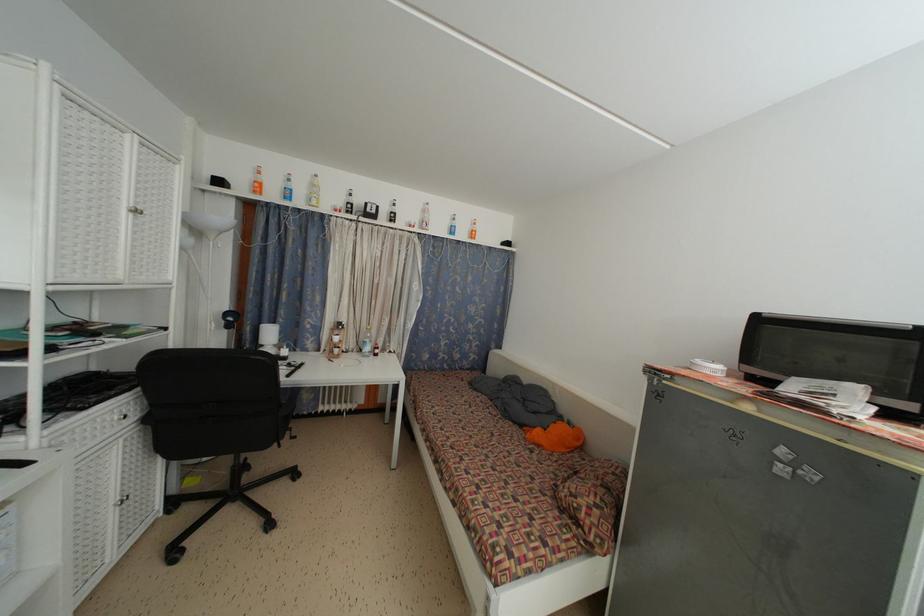
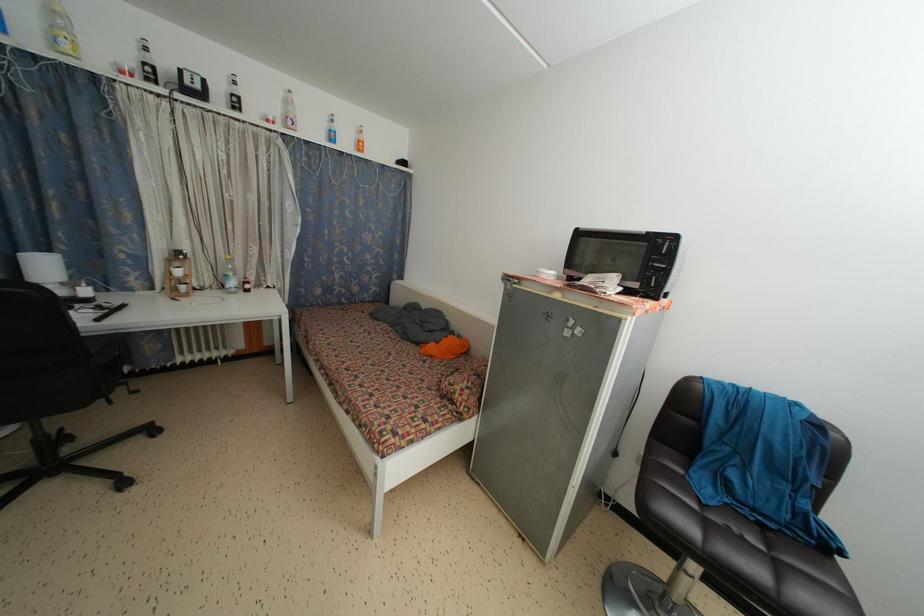
In the second image, find the point that corresponds to pixel 277 328 in the first image.

(52, 254)